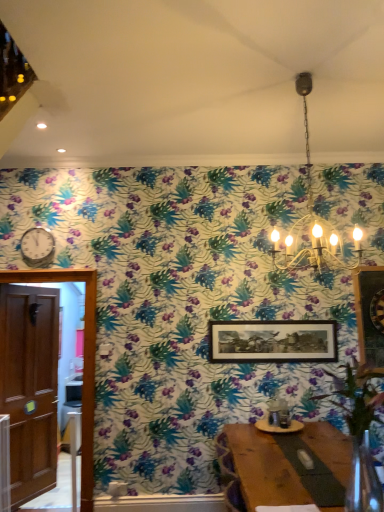
The width and height of the screenshot is (384, 512). Describe the element at coordinates (273, 341) in the screenshot. I see `wooden framed picture at center` at that location.

This screenshot has width=384, height=512. Find the location of `metallic chandelier at upper center`. metallic chandelier at upper center is located at coordinates (312, 219).

Between wooden framed picture at center and metallic silver clock at left, which one appears on the left side from the viewer's perspective?

metallic silver clock at left is more to the left.

Would you say metallic silver clock at left is part of wooden framed picture at center's contents?

Actually, metallic silver clock at left is outside wooden framed picture at center.

From their relative heights in the image, would you say wooden framed picture at center is taller or shorter than metallic silver clock at left?

wooden framed picture at center is taller than metallic silver clock at left.

Are wooden framed picture at center and metallic silver clock at left beside each other?

No, wooden framed picture at center is not with metallic silver clock at left.

Which object is further away from the camera, metallic chandelier at upper center or wooden framed picture at center?

wooden framed picture at center is more distant.

Which object is positioned more to the left, metallic chandelier at upper center or wooden framed picture at center?

metallic chandelier at upper center.

Consider the image. From a real-world perspective, which object stands above the other?

In real-world perspective, metallic chandelier at upper center is above.

Consider the image. From the image's perspective, relative to metallic chandelier at upper center, is wooden framed picture at center above or below?

Based on their image positions, wooden framed picture at center is located beneath metallic chandelier at upper center.

In terms of width, does wooden framed picture at center look wider or thinner when compared to metallic chandelier at upper center?

Considering their sizes, wooden framed picture at center looks slimmer than metallic chandelier at upper center.

Is point (336, 356) positioned after point (324, 233)?

No, it is in front of (324, 233).

Is wooden framed picture at center taller or shorter than metallic chandelier at upper center?

Clearly, wooden framed picture at center is shorter compared to metallic chandelier at upper center.

Can we say metallic silver clock at left lies outside metallic chandelier at upper center?

Indeed, metallic silver clock at left is completely outside metallic chandelier at upper center.

Between metallic silver clock at left and metallic chandelier at upper center, which one has larger size?

Bigger between the two is metallic chandelier at upper center.

From the image's perspective, does metallic silver clock at left appear lower than metallic chandelier at upper center?

Yes, from the image's perspective, metallic silver clock at left is below metallic chandelier at upper center.

Which point is more forward, [23,247] or [307,143]?

The point [307,143] is closer.

At what (x,y) coordinates should I click in order to perform the action: click on clock above the wooden framed picture at center (from the image's perspective). Please return your answer as a coordinate pair (x, y). Looking at the image, I should click on (37, 247).

From the image's perspective, is metallic silver clock at left above or below wooden framed picture at center?

From the image's perspective, metallic silver clock at left appears above wooden framed picture at center.

Can you confirm if metallic silver clock at left is bigger than wooden framed picture at center?

Actually, metallic silver clock at left might be smaller than wooden framed picture at center.

From the image's perspective, is metallic silver clock at left on wooden door at left?

Yes.

Would you say metallic silver clock at left is a long distance from wooden door at left?

Yes, metallic silver clock at left and wooden door at left are quite far apart.

Which is behind, point (43, 255) or point (39, 383)?

The point (39, 383) is more distant.

Is metallic silver clock at left looking in the opposite direction of wooden door at left?

No.

Could you tell me if metallic chandelier at upper center is turned towards wooden door at left?

No, metallic chandelier at upper center is not facing towards wooden door at left.

From a real-world perspective, is metallic chandelier at upper center below wooden door at left?

No.

Considering their positions, is metallic chandelier at upper center located in front of or behind wooden door at left?

metallic chandelier at upper center is positioned closer to the viewer than wooden door at left.

Locate an element on the screen. This screenshot has width=384, height=512. picture frame below the metallic silver clock at left (from a real-world perspective) is located at coordinates (273, 341).

I want to click on picture frame on the right of metallic chandelier at upper center, so click(273, 341).

Based on their spatial positions, is metallic chandelier at upper center or metallic silver clock at left further from wooden door at left?

Based on the image, metallic chandelier at upper center appears to be further to wooden door at left.

Which object lies nearer to the anchor point metallic chandelier at upper center, metallic silver clock at left or wooden door at left?

Based on the image, metallic silver clock at left appears to be nearer to metallic chandelier at upper center.

Looking at this image, based on their spatial positions, is wooden framed picture at center or metallic chandelier at upper center closer to wooden door at left?

wooden framed picture at center is positioned closer to the anchor wooden door at left.

Looking at the image, which one is located further to wooden framed picture at center, metallic silver clock at left or metallic chandelier at upper center?

metallic silver clock at left lies further to wooden framed picture at center than the other object.

In the scene shown: Looking at the image, which one is located closer to metallic silver clock at left, wooden framed picture at center or wooden door at left?

wooden door at left is positioned closer to the anchor metallic silver clock at left.

Looking at the image, which one is located closer to wooden door at left, wooden framed picture at center or metallic silver clock at left?

metallic silver clock at left.

In the scene shown: Based on their spatial positions, is wooden door at left or metallic chandelier at upper center closer to wooden framed picture at center?

Based on the image, metallic chandelier at upper center appears to be nearer to wooden framed picture at center.

When comparing their distances from metallic silver clock at left, does wooden door at left or wooden framed picture at center seem further?

wooden framed picture at center is positioned further to the anchor metallic silver clock at left.

Locate an element on the screen. The height and width of the screenshot is (512, 384). light fixture between wooden door at left and wooden framed picture at center from left to right is located at coordinates (312, 219).

Find the location of a particular element. clock between wooden door at left and metallic chandelier at upper center in the horizontal direction is located at coordinates (37, 247).

Locate an element on the screen. light fixture between metallic silver clock at left and wooden framed picture at center in the horizontal direction is located at coordinates (312, 219).

The height and width of the screenshot is (512, 384). I want to click on clock between wooden door at left and wooden framed picture at center from left to right, so click(x=37, y=247).